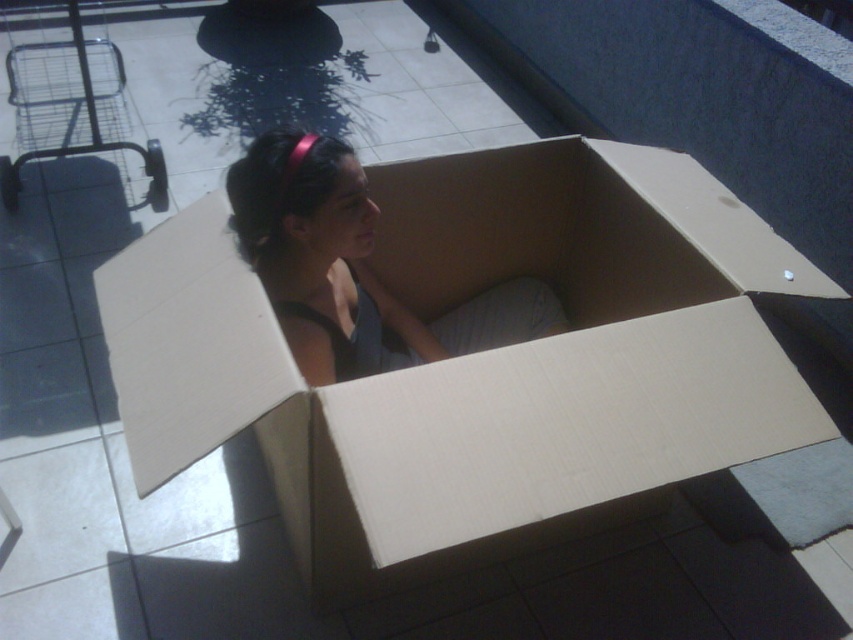
Question: Is cardboard box at center to the right of matte cardboard girl at center from the viewer's perspective?

Choices:
 (A) no
 (B) yes

Answer: (B)

Question: Can you confirm if cardboard box at center is positioned below matte cardboard girl at center?

Choices:
 (A) yes
 (B) no

Answer: (A)

Question: Is cardboard box at center closer to camera compared to matte cardboard girl at center?

Choices:
 (A) no
 (B) yes

Answer: (B)